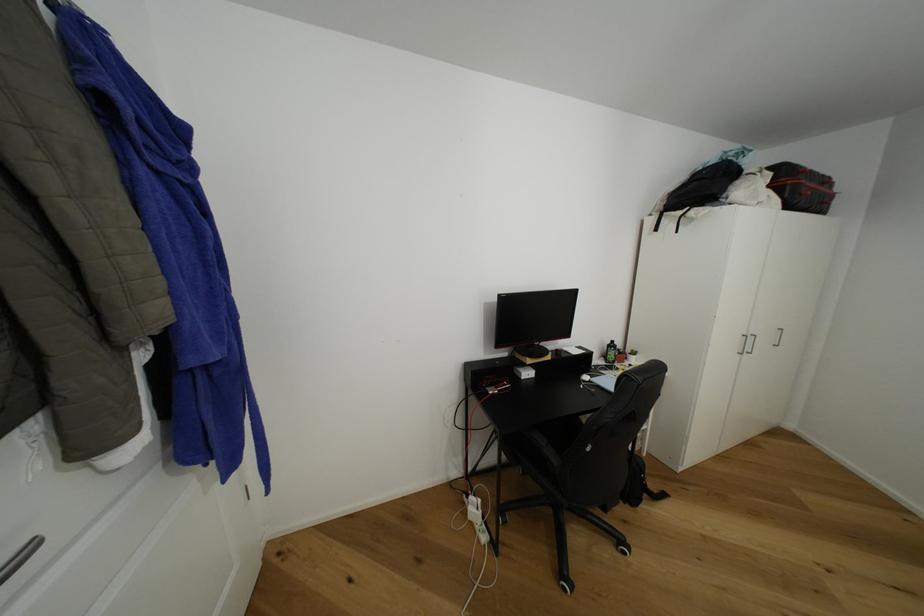
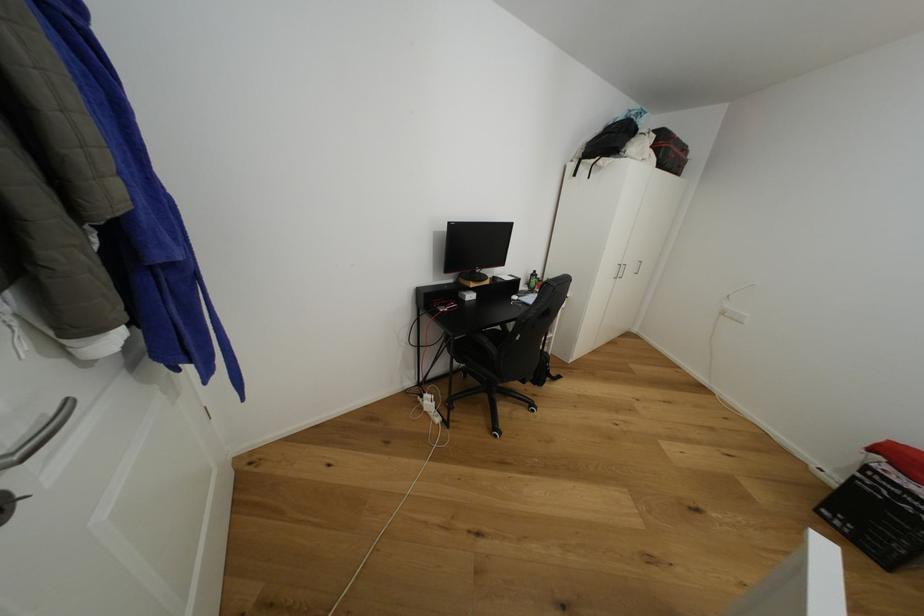
The point at (x=526, y=371) is marked in the first image. Where is the corresponding point in the second image?

(469, 294)